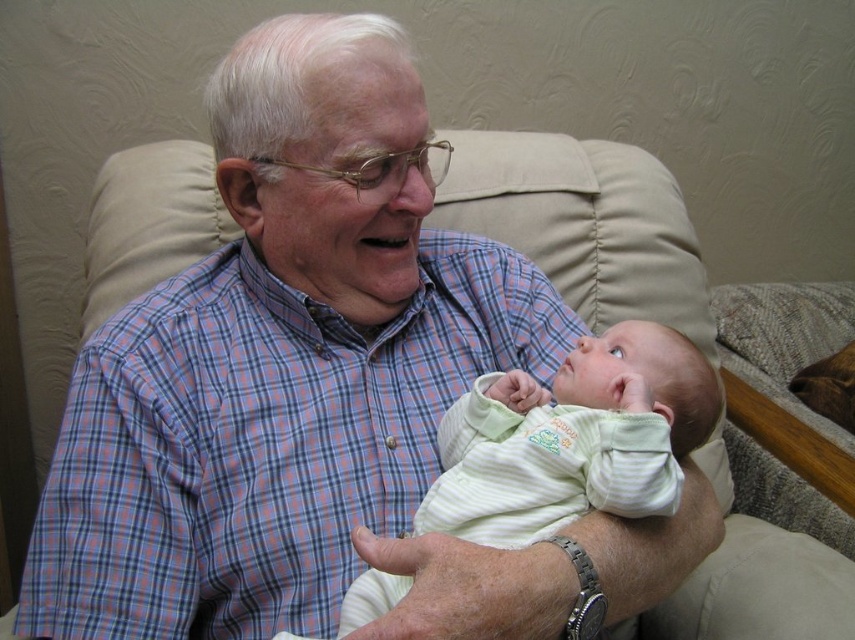
You are a photographer taking a closeup shot of the plaid cotton shirt at center and the light green striped fabric baby at center. Which object should you focus on first if you want to capture both in sharp detail?

The plaid cotton shirt at center is bigger than the light green striped striped fabric baby at center, so you should focus on the plaid cotton shirt at center first to ensure both are in sharp detail.